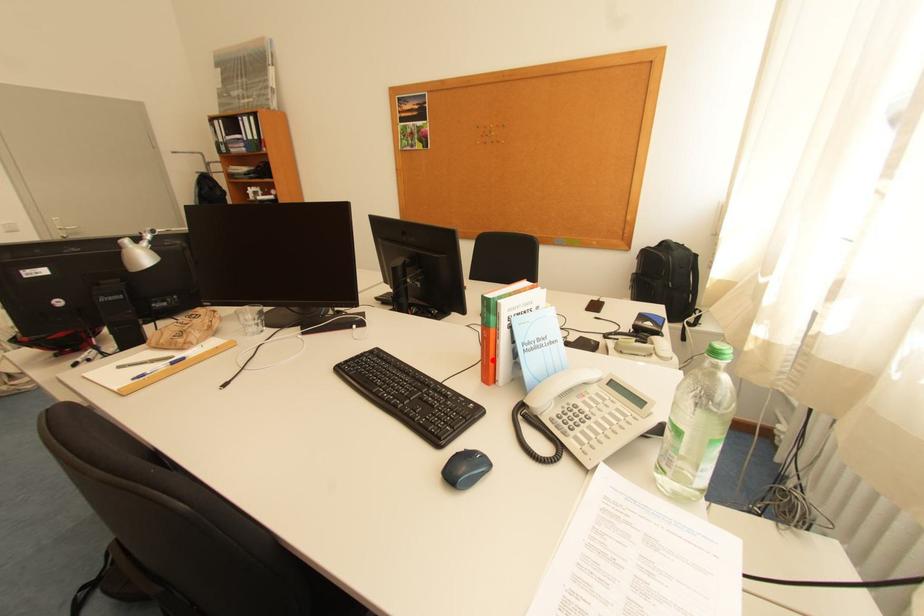
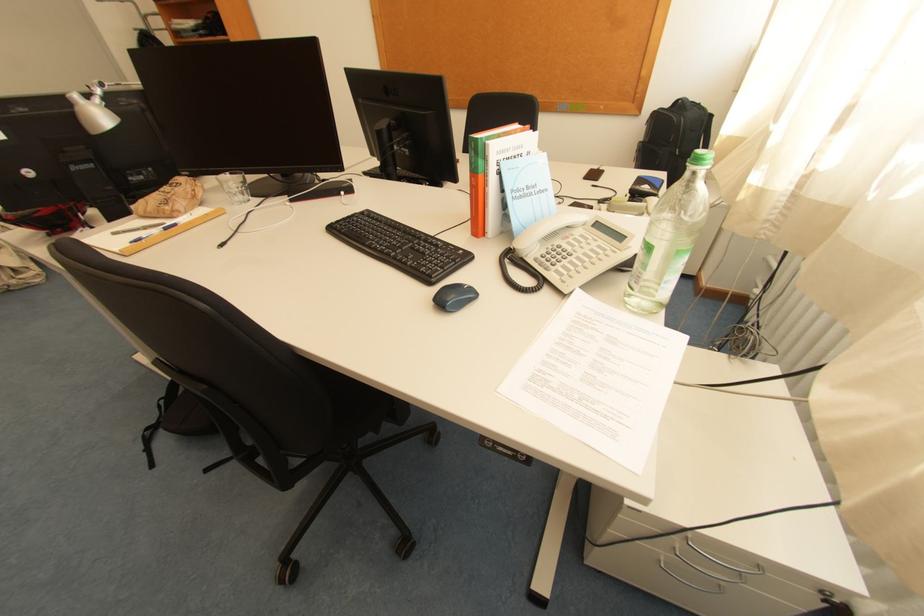
Where in the second image is the point corresponding to the highlighted location from the first image?

(482, 211)